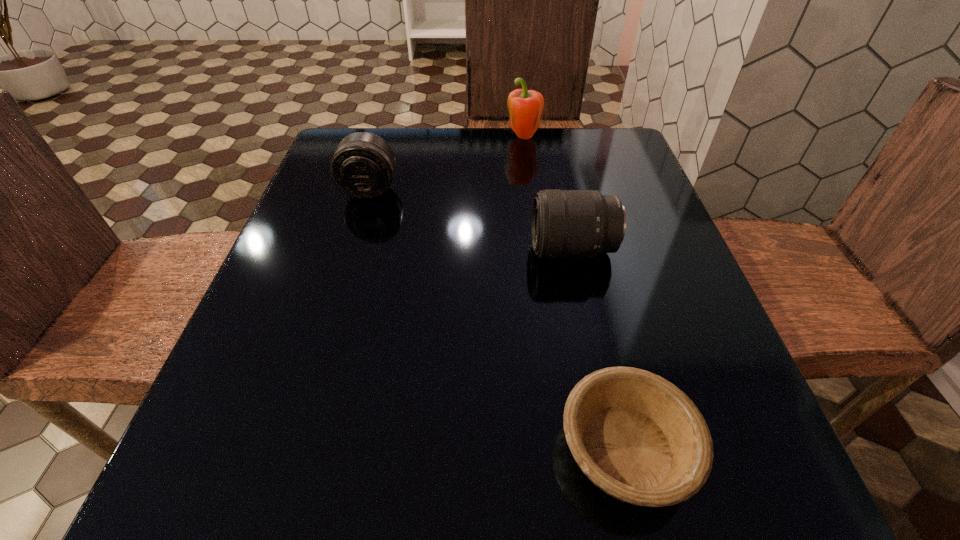
Find the location of a particular element. The height and width of the screenshot is (540, 960). pepper is located at coordinates (525, 106).

This screenshot has height=540, width=960. Identify the location of the farthest object. (525, 106).

Locate an element on the screen. Image resolution: width=960 pixels, height=540 pixels. the leftmost object is located at coordinates (363, 165).

Where is `the farther telephoto lens`? This screenshot has width=960, height=540. the farther telephoto lens is located at coordinates (363, 165).

This screenshot has width=960, height=540. In order to click on the right telephoto lens in this screenshot , I will do `click(565, 223)`.

Locate an element on the screen. the nearer telephoto lens is located at coordinates (565, 223).

Locate an element on the screen. the nearest object is located at coordinates (639, 438).

At what (x,y) coordinates should I click in order to perform the action: click on bowl. Please return your answer as a coordinate pair (x, y). The width and height of the screenshot is (960, 540). Looking at the image, I should click on (639, 438).

Image resolution: width=960 pixels, height=540 pixels. I want to click on vacant space located on the right of the tallest object, so click(x=599, y=139).

This screenshot has width=960, height=540. What are the coordinates of `vacant space situated on the front-facing side of the left telephoto lens` in the screenshot? It's located at (340, 290).